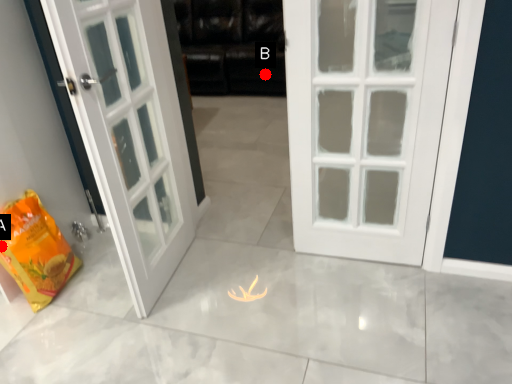
Question: Two points are circled on the image, labeled by A and B beside each circle. Among these points, which one is farthest from the camera?

Choices:
 (A) A is further
 (B) B is further

Answer: (B)